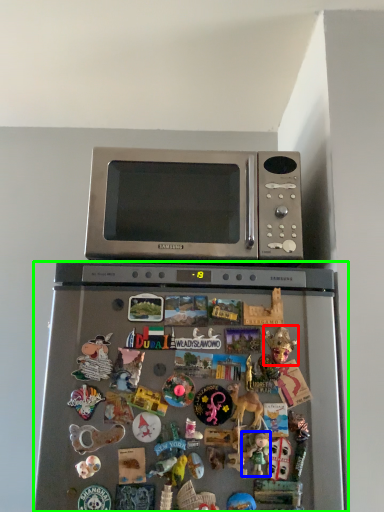
Question: Estimate the real-world distances between objects in this image. Which object is closer to toy (highlighted by a red box), toy (highlighted by a blue box) or refrigerator (highlighted by a green box)?

Choices:
 (A) toy
 (B) refrigerator

Answer: (A)